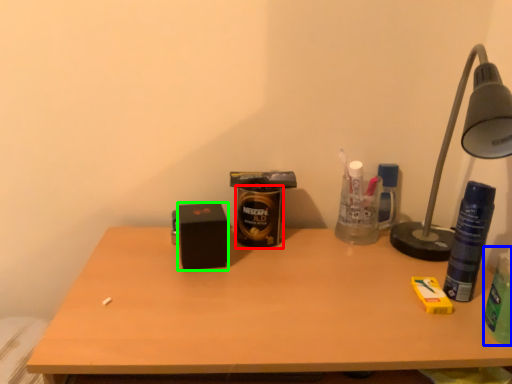
Question: Which object is the closest to the beverage (highlighted by a red box)? Choose among these: beverage (highlighted by a blue box) or box (highlighted by a green box).

Choices:
 (A) beverage
 (B) box

Answer: (B)